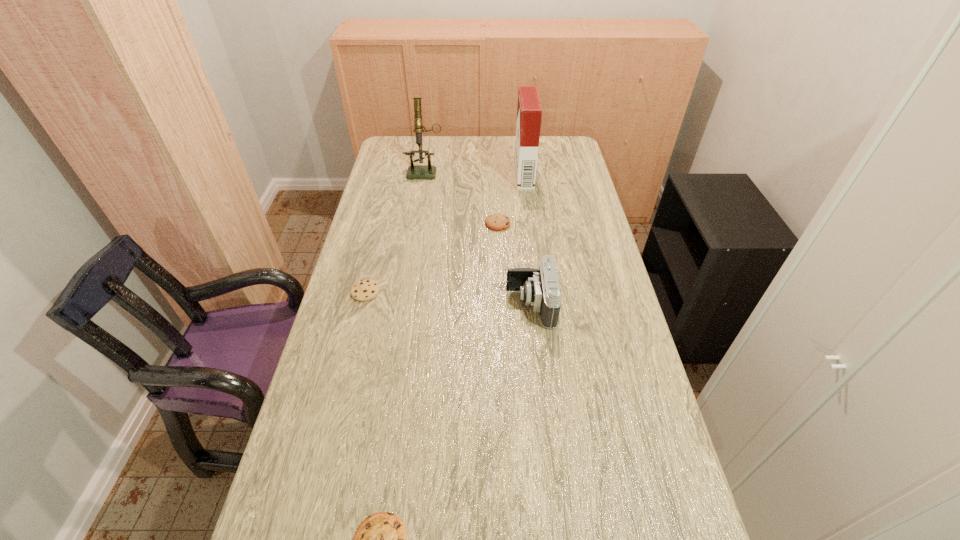
At what (x,y) coordinates should I click in order to perform the action: click on cigarette_case. Please return your answer as a coordinate pair (x, y). Image resolution: width=960 pixels, height=540 pixels. Looking at the image, I should click on (529, 111).

Locate an element on the screen. microscope is located at coordinates (428, 171).

I want to click on the fourth shortest object, so click(x=540, y=288).

Locate an element on the screen. the leftmost cookie is located at coordinates (364, 290).

At what (x,y) coordinates should I click in order to perform the action: click on the second nearest cookie. Please return your answer as a coordinate pair (x, y). Image resolution: width=960 pixels, height=540 pixels. Looking at the image, I should click on (364, 290).

Where is `the rightmost cookie`? the rightmost cookie is located at coordinates (496, 222).

At what (x,y) coordinates should I click in order to perform the action: click on the third farthest object. Please return your answer as a coordinate pair (x, y). The image size is (960, 540). Looking at the image, I should click on (496, 222).

Where is `free spot located on the front-facing side of the cigarette_case`? This screenshot has width=960, height=540. free spot located on the front-facing side of the cigarette_case is located at coordinates (420, 175).

This screenshot has height=540, width=960. Identify the location of vacant space located 0.180m on the front-facing side of the cigarette_case. (471, 175).

At what (x,y) coordinates should I click in order to perform the action: click on blank area located on the front-facing side of the cigarette_case. Please return your answer as a coordinate pair (x, y). Looking at the image, I should click on (449, 175).